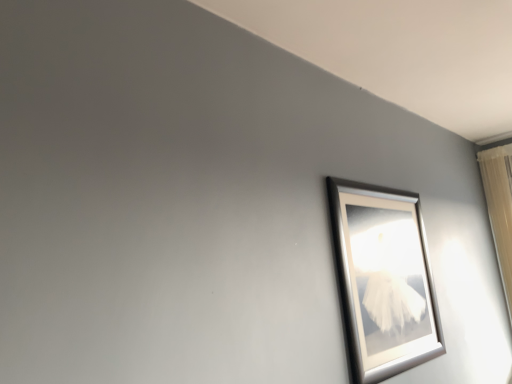
Question: Considering their positions, is silver metallic picture frame at upper right located in front of or behind beige fabric curtain at right?

Choices:
 (A) front
 (B) behind

Answer: (A)

Question: Is silver metallic picture frame at upper right bigger or smaller than beige fabric curtain at right?

Choices:
 (A) small
 (B) big

Answer: (A)

Question: Is silver metallic picture frame at upper right wider or thinner than beige fabric curtain at right?

Choices:
 (A) thin
 (B) wide

Answer: (A)

Question: Would you say beige fabric curtain at right is inside or outside silver metallic picture frame at upper right?

Choices:
 (A) inside
 (B) outside

Answer: (B)

Question: Is beige fabric curtain at right in front of or behind silver metallic picture frame at upper right in the image?

Choices:
 (A) behind
 (B) front

Answer: (A)

Question: From their relative heights in the image, would you say beige fabric curtain at right is taller or shorter than silver metallic picture frame at upper right?

Choices:
 (A) tall
 (B) short

Answer: (A)

Question: Would you say beige fabric curtain at right is to the left or to the right of silver metallic picture frame at upper right in the picture?

Choices:
 (A) right
 (B) left

Answer: (A)